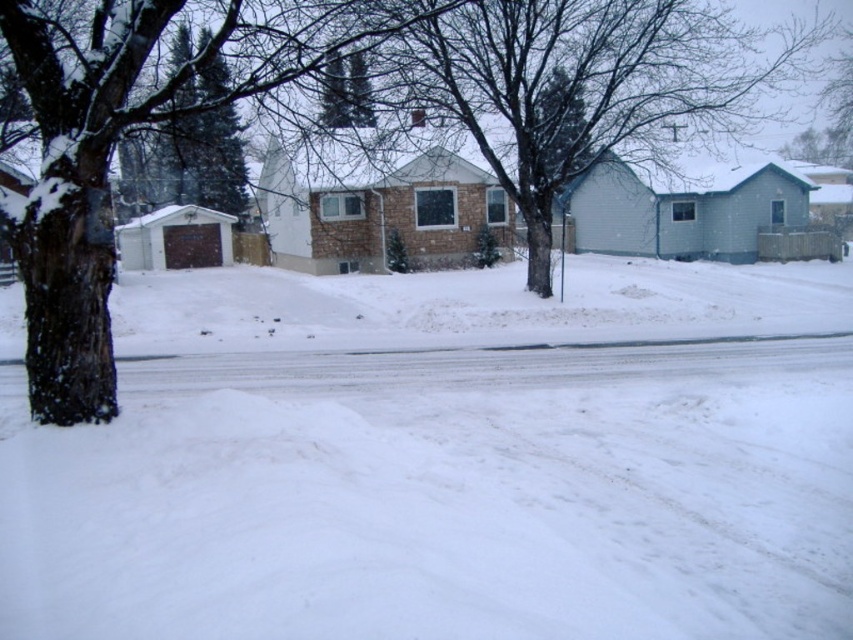
Does white fluffy snow at lower center have a smaller size compared to bare branches at center?

Indeed, white fluffy snow at lower center has a smaller size compared to bare branches at center.

The height and width of the screenshot is (640, 853). I want to click on white fluffy snow at lower center, so click(x=445, y=461).